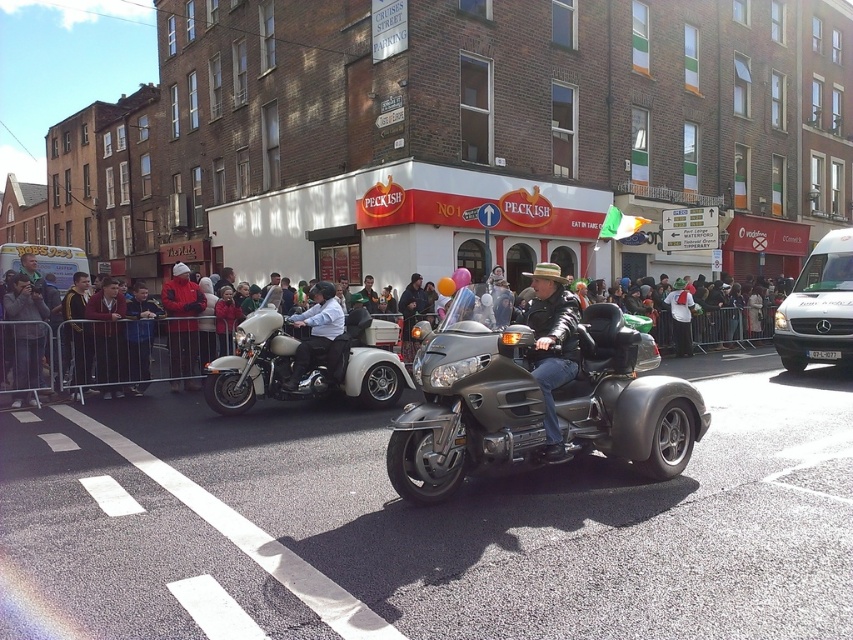
Does metallic trike at center have a smaller size compared to multicolored fabric crowd at center?

Yes, metallic trike at center is smaller than multicolored fabric crowd at center.

Is point (618, 323) farther from camera compared to point (210, 355)?

No.

Who is more forward, [583,364] or [758,340]?

Point [583,364] is more forward.

Where is `metallic trike at center`? metallic trike at center is located at coordinates (537, 396).

Does point (276, 364) come behind point (175, 298)?

No.

Between white matte trike at center and red jacket at center, which one is positioned lower?

Positioned lower is white matte trike at center.

Is point (221, 390) farther from camera compared to point (175, 308)?

No, it is not.

You are a GUI agent. You are given a task and a screenshot of the screen. Output one action in this format:
    pyautogui.click(x=<x>, y=<y>)
    Task: Click on the white matte trike at center
    This screenshot has height=640, width=853.
    Given the screenshot: What is the action you would take?
    pyautogui.click(x=306, y=356)

Between white matte trike at center and multicolored fabric crowd at center, which one has more height?

multicolored fabric crowd at center is taller.

This screenshot has height=640, width=853. In order to click on white matte trike at center in this screenshot , I will do `click(306, 356)`.